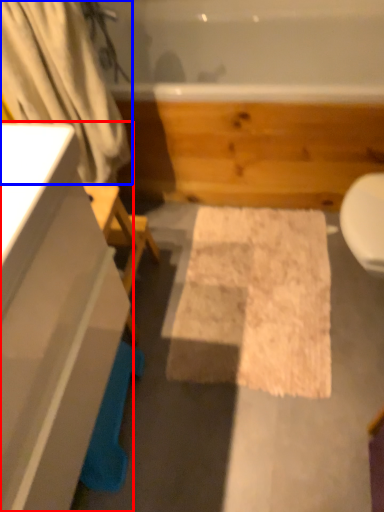
Question: Among these objects, which one is nearest to the camera, bathroom cabinet (highlighted by a red box) or shower curtain (highlighted by a blue box)?

Choices:
 (A) bathroom cabinet
 (B) shower curtain

Answer: (A)